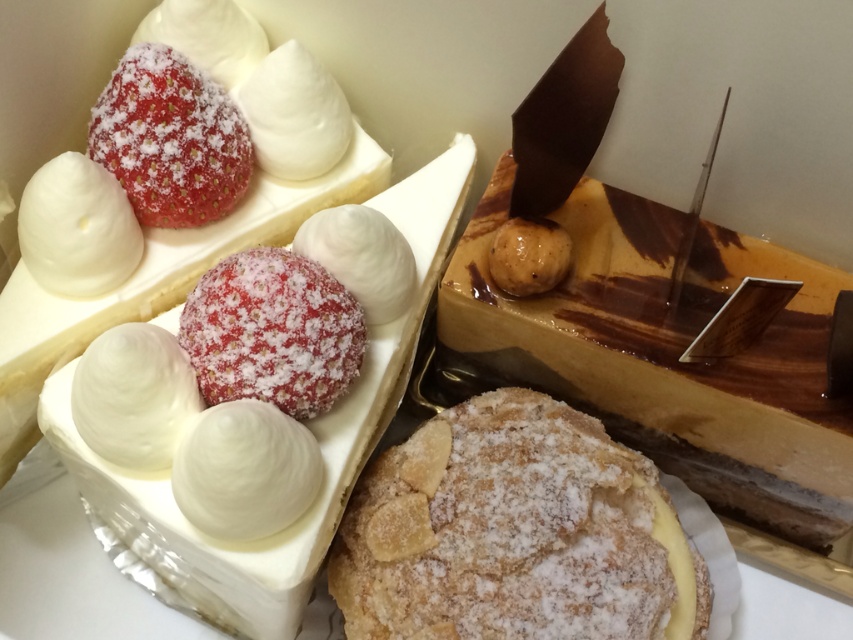
Question: Which of the following is the farthest from the observer?

Choices:
 (A) sugar-coated strawberry at center
 (B) white fluffy ball at center

Answer: (B)

Question: Estimate the real-world distances between objects in this image. Which object is closer to the sugar-coated strawberry at center?

Choices:
 (A) powdered sugar pastry at center
 (B) white glossy meringue at upper center
 (C) white meringue at upper left
 (D) white fluffy ball at center

Answer: (D)

Question: Does matte white cheesecake at upper left appear on the left side of white meringue at upper left?

Choices:
 (A) yes
 (B) no

Answer: (B)

Question: Is sugar-coated strawberry at center closer to the viewer compared to white fluffy ball at center?

Choices:
 (A) yes
 (B) no

Answer: (A)

Question: Which point is closer to the camera taking this photo?

Choices:
 (A) (277, 118)
 (B) (83, 136)
 (C) (22, 244)

Answer: (C)

Question: Can you confirm if sugar-coated strawberry at center is bigger than white glossy meringue at upper center?

Choices:
 (A) yes
 (B) no

Answer: (A)